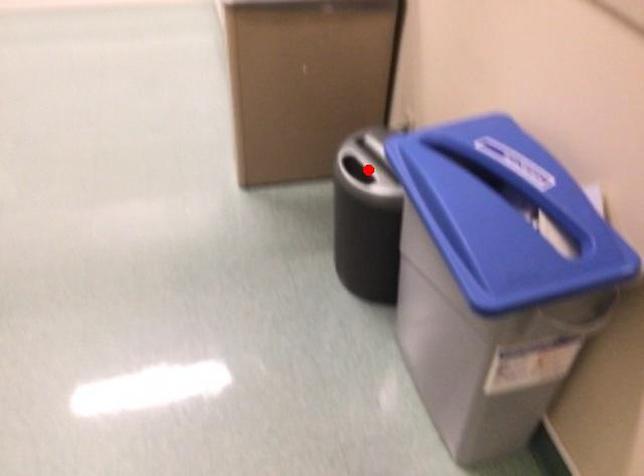
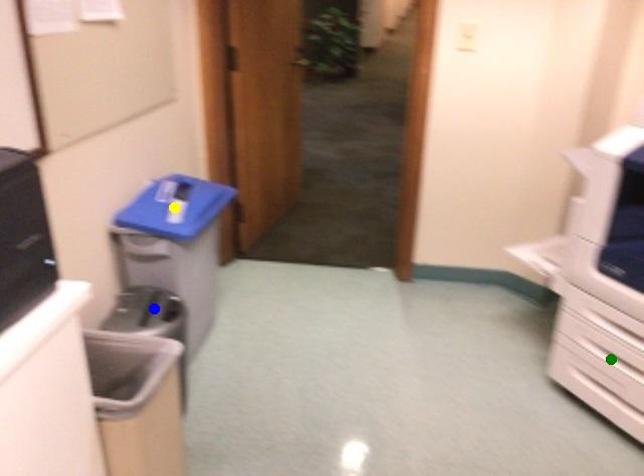
Question: I am providing you with two images of the same scene from different viewpoints. A red point is marked on the first image. You are given multiple points on the second image. In image 2, which mark is for the same physical point as the one in image 1?

Choices:
 (A) yellow point
 (B) green point
 (C) blue point

Answer: (C)